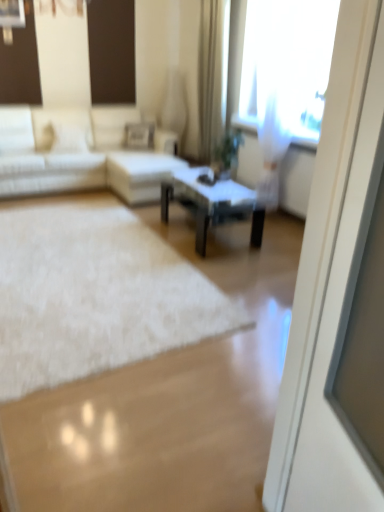
Question: From the image's perspective, is white glossy screen door at right on white fabric couch at left?

Choices:
 (A) yes
 (B) no

Answer: (B)

Question: Is the depth of white glossy screen door at right greater than that of white fabric couch at left?

Choices:
 (A) no
 (B) yes

Answer: (A)

Question: Considering the relative positions of white glossy screen door at right and white fabric couch at left in the image provided, is white glossy screen door at right to the left of white fabric couch at left from the viewer's perspective?

Choices:
 (A) no
 (B) yes

Answer: (A)

Question: Would you say white fabric couch at left is part of white glossy screen door at right's contents?

Choices:
 (A) no
 (B) yes

Answer: (A)

Question: Considering the relative sizes of white glossy screen door at right and white fabric couch at left in the image provided, is white glossy screen door at right smaller than white fabric couch at left?

Choices:
 (A) no
 (B) yes

Answer: (B)

Question: Visually, is transparent curtain at upper right positioned to the left or to the right of beige fabric curtain at upper center?

Choices:
 (A) right
 (B) left

Answer: (A)

Question: From the image's perspective, is transparent curtain at upper right positioned above or below beige fabric curtain at upper center?

Choices:
 (A) above
 (B) below

Answer: (B)

Question: In terms of width, does transparent curtain at upper right look wider or thinner when compared to beige fabric curtain at upper center?

Choices:
 (A) wide
 (B) thin

Answer: (A)

Question: From a real-world perspective, is transparent curtain at upper right above or below beige fabric curtain at upper center?

Choices:
 (A) below
 (B) above

Answer: (A)

Question: In the image, is transparent curtain at upper right on the left side or the right side of white fabric couch at left?

Choices:
 (A) left
 (B) right

Answer: (B)

Question: Relative to white fabric couch at left, is transparent curtain at upper right in front or behind?

Choices:
 (A) behind
 (B) front

Answer: (B)

Question: From the image's perspective, is transparent curtain at upper right located above or below white fabric couch at left?

Choices:
 (A) below
 (B) above

Answer: (B)

Question: In terms of width, does transparent curtain at upper right look wider or thinner when compared to white fabric couch at left?

Choices:
 (A) wide
 (B) thin

Answer: (B)

Question: Is white fluffy rug at center inside the boundaries of black glass coffee table at center, or outside?

Choices:
 (A) outside
 (B) inside

Answer: (A)

Question: From a real-world perspective, is white fluffy rug at center positioned above or below black glass coffee table at center?

Choices:
 (A) above
 (B) below

Answer: (B)